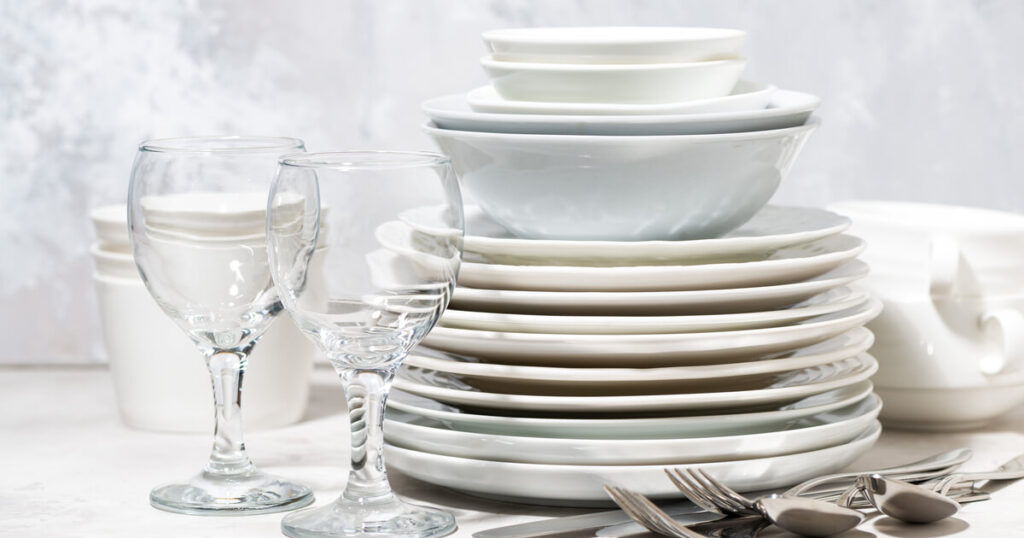
Find the location of a particular element. The image size is (1024, 538). plates is located at coordinates (593, 253), (591, 279), (590, 299), (591, 327), (592, 346), (586, 377), (584, 404), (591, 424), (596, 448), (575, 479).